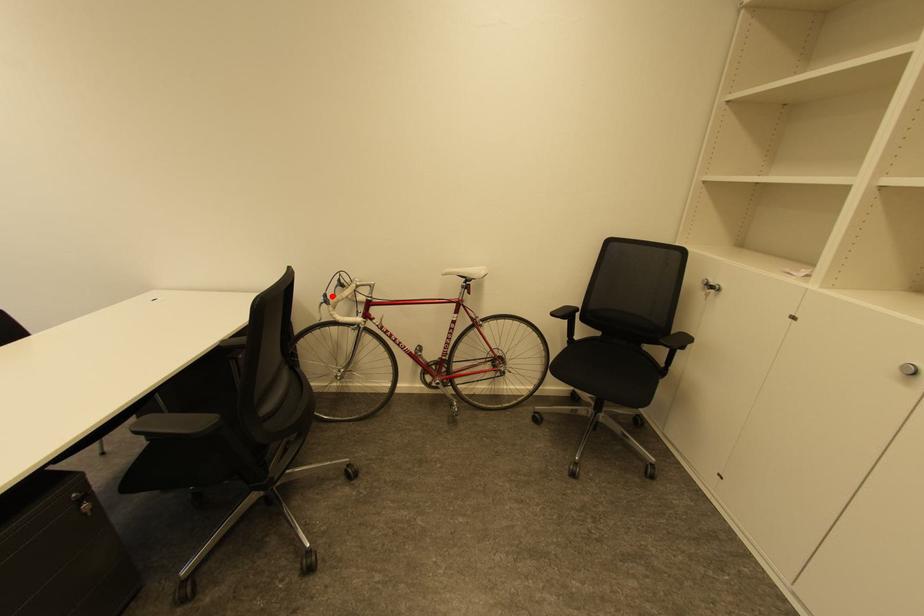
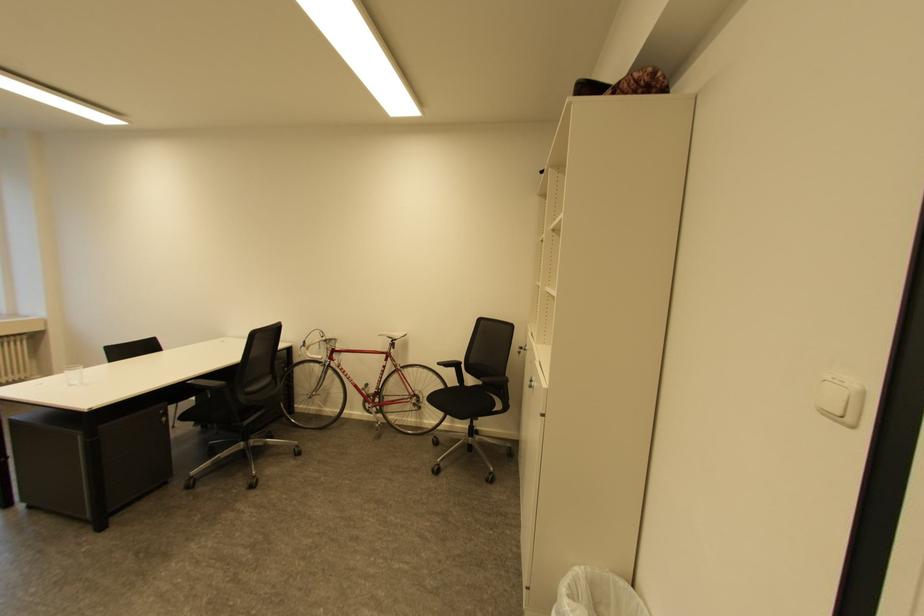
Question: A red point is marked in image1. In image2, is the corresponding 3D point closer to the camera or farther? Reply with the corresponding letter.

Choices:
 (A) The corresponding 3D point is closer.
 (B) The corresponding 3D point is farther.

Answer: (B)